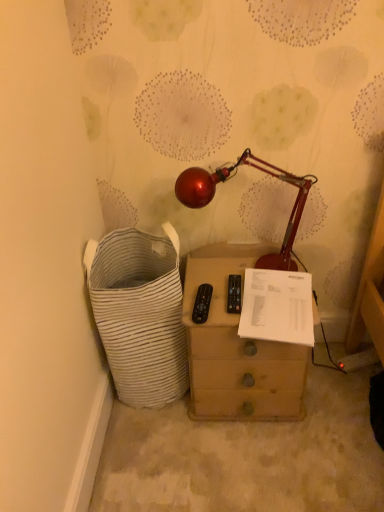
Question: Should I look upward or downward to see white striped fabric laundry basket at left?

Choices:
 (A) up
 (B) down

Answer: (B)

Question: Is white striped fabric laundry basket at left taller than white paper at center?

Choices:
 (A) no
 (B) yes

Answer: (B)

Question: Is white striped fabric laundry basket at left aimed at white paper at center?

Choices:
 (A) yes
 (B) no

Answer: (B)

Question: From the image's perspective, is white striped fabric laundry basket at left on top of white paper at center?

Choices:
 (A) yes
 (B) no

Answer: (B)

Question: Is white striped fabric laundry basket at left looking in the opposite direction of white paper at center?

Choices:
 (A) no
 (B) yes

Answer: (A)

Question: Does white striped fabric laundry basket at left have a lesser width compared to white paper at center?

Choices:
 (A) no
 (B) yes

Answer: (A)

Question: Does white striped fabric laundry basket at left come behind white paper at center?

Choices:
 (A) no
 (B) yes

Answer: (A)

Question: Considering the relative positions of white striped fabric laundry basket at left and wooden chest of drawers at center in the image provided, is white striped fabric laundry basket at left to the left of wooden chest of drawers at center from the viewer's perspective?

Choices:
 (A) yes
 (B) no

Answer: (A)

Question: Is wooden chest of drawers at center a part of white striped fabric laundry basket at left?

Choices:
 (A) no
 (B) yes

Answer: (A)

Question: Is white striped fabric laundry basket at left completely or partially outside of wooden chest of drawers at center?

Choices:
 (A) no
 (B) yes

Answer: (B)

Question: From a real-world perspective, is white striped fabric laundry basket at left physically above wooden chest of drawers at center?

Choices:
 (A) yes
 (B) no

Answer: (A)

Question: Is white striped fabric laundry basket at left closer to camera compared to wooden chest of drawers at center?

Choices:
 (A) no
 (B) yes

Answer: (B)

Question: Does white striped fabric laundry basket at left have a lesser height compared to wooden chest of drawers at center?

Choices:
 (A) yes
 (B) no

Answer: (B)

Question: Is white striped fabric laundry basket at left further to the viewer compared to shiny metallic lamp at center?

Choices:
 (A) no
 (B) yes

Answer: (A)